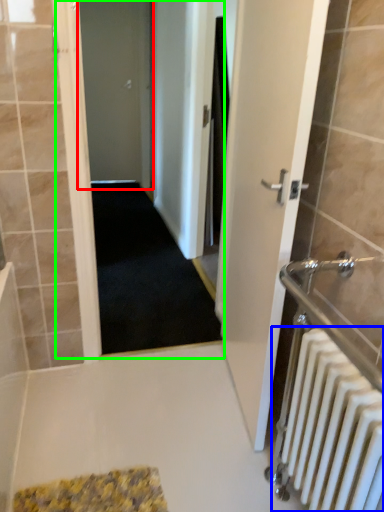
Question: Which object is the farthest from door (highlighted by a red box)? Choose among these: radiator (highlighted by a blue box) or corridor (highlighted by a green box).

Choices:
 (A) radiator
 (B) corridor

Answer: (A)